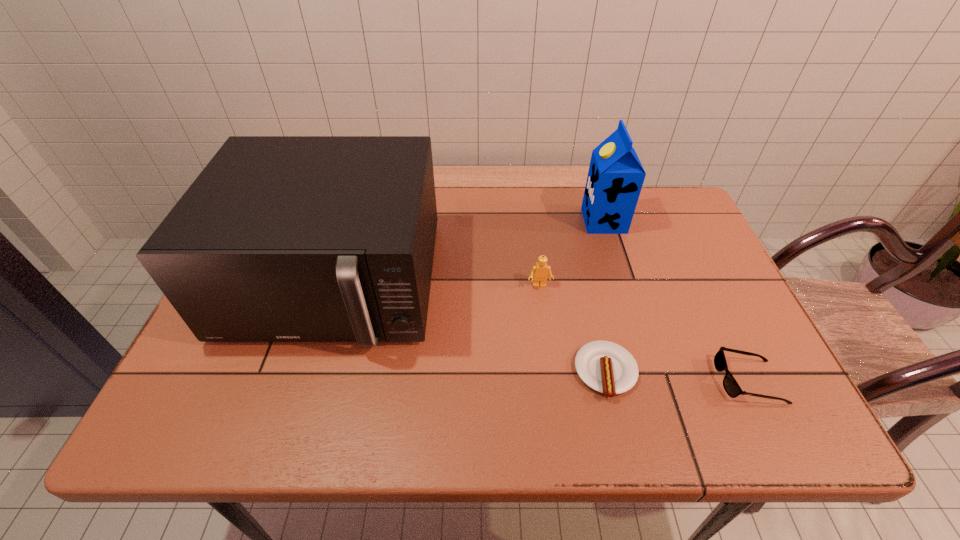
Find the location of a particular element. Image resolution: width=960 pixels, height=540 pixels. object that is at the left edge is located at coordinates (280, 238).

Where is `object that is at the right edge`? object that is at the right edge is located at coordinates (x=732, y=388).

At what (x,y) coordinates should I click in order to perform the action: click on object located at the far left corner. Please return your answer as a coordinate pair (x, y). The image size is (960, 540). Looking at the image, I should click on (280, 238).

The image size is (960, 540). What are the coordinates of `object that is positioned at the near right corner` in the screenshot? It's located at (732, 388).

In the image, there is a desktop. Where is `vacant area at the far edge`? vacant area at the far edge is located at coordinates (449, 219).

The image size is (960, 540). Find the location of `free space at the near edge of the desktop`. free space at the near edge of the desktop is located at coordinates 612,400.

Locate an element on the screen. free location at the left edge is located at coordinates (222, 391).

Identify the location of free space at the right edge of the desktop. The height and width of the screenshot is (540, 960). (762, 356).

This screenshot has width=960, height=540. What are the coordinates of `free space at the near left corner of the desktop` in the screenshot? It's located at (209, 438).

Where is `vacant region at the near right corner of the desktop`? vacant region at the near right corner of the desktop is located at coordinates (750, 415).